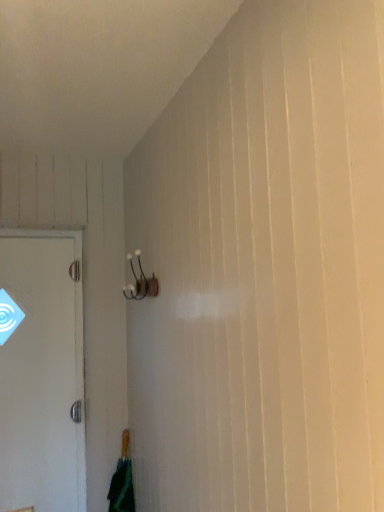
The height and width of the screenshot is (512, 384). What do you see at coordinates (42, 373) in the screenshot? I see `white matte door at left` at bounding box center [42, 373].

The width and height of the screenshot is (384, 512). Find the location of `white matte door at left`. white matte door at left is located at coordinates (42, 373).

Find the location of a particular element. Image resolution: width=384 pixels, height=512 pixels. white matte door at left is located at coordinates (42, 373).